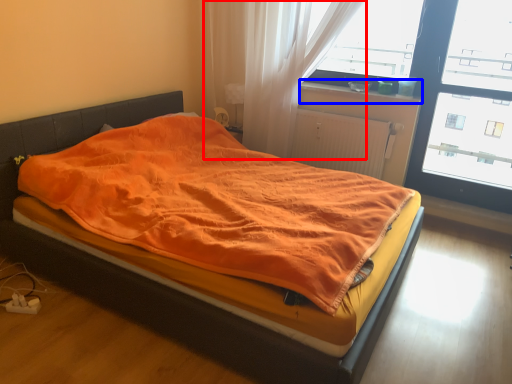
Question: Which object appears closest to the camera in this image, curtain (highlighted by a red box) or window sill (highlighted by a blue box)?

Choices:
 (A) curtain
 (B) window sill

Answer: (A)